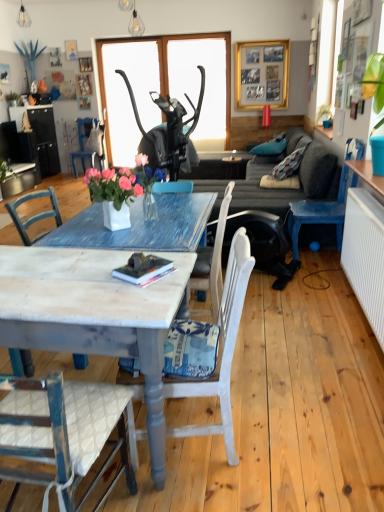
You are a GUI agent. You are given a task and a screenshot of the screen. Output one action in this format:
    pyautogui.click(x=<x>, y=<y>)
    Task: Click on the blank space situated above hardcover book at center (from a real-world perspective)
    
    Given the screenshot: What is the action you would take?
    pyautogui.click(x=148, y=267)